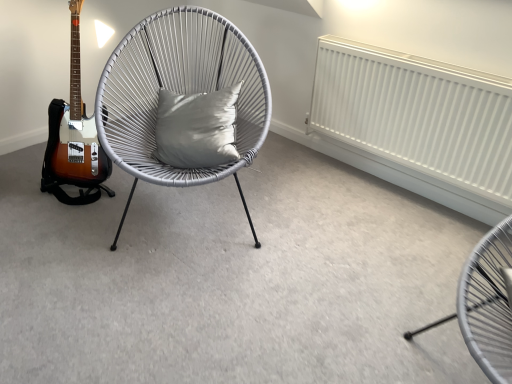
Question: From a real-world perspective, is satin gray cushion at center located beneath white matte radiator at upper right?

Choices:
 (A) no
 (B) yes

Answer: (A)

Question: Considering the relative positions of satin gray cushion at center and white matte radiator at upper right in the image provided, is satin gray cushion at center to the right of white matte radiator at upper right from the viewer's perspective?

Choices:
 (A) yes
 (B) no

Answer: (B)

Question: Considering the relative sizes of satin gray cushion at center and white matte radiator at upper right in the image provided, is satin gray cushion at center bigger than white matte radiator at upper right?

Choices:
 (A) yes
 (B) no

Answer: (B)

Question: From a real-world perspective, is satin gray cushion at center over white matte radiator at upper right?

Choices:
 (A) no
 (B) yes

Answer: (B)

Question: Does satin gray cushion at center come in front of white matte radiator at upper right?

Choices:
 (A) no
 (B) yes

Answer: (A)

Question: Does satin gray cushion at center have a lesser width compared to white matte radiator at upper right?

Choices:
 (A) yes
 (B) no

Answer: (B)

Question: From a real-world perspective, does matte grey chair at lower right, placed as the second chair when sorted from back to front, sit lower than satin gray cushion at center?

Choices:
 (A) no
 (B) yes

Answer: (B)

Question: Is satin gray cushion at center inside matte grey chair at lower right, placed as the second chair when sorted from back to front?

Choices:
 (A) yes
 (B) no

Answer: (B)

Question: Is the position of matte grey chair at lower right, the 1th chair positioned from the right, more distant than that of satin gray cushion at center?

Choices:
 (A) no
 (B) yes

Answer: (A)

Question: From a real-world perspective, is matte grey chair at lower right, the 1th chair positioned from the right, on top of satin gray cushion at center?

Choices:
 (A) yes
 (B) no

Answer: (B)

Question: Is matte grey chair at lower right, which is the first chair from front to back, bigger than satin gray cushion at center?

Choices:
 (A) yes
 (B) no

Answer: (A)

Question: Does matte grey chair at lower right, the 1th chair positioned from the right, have a greater width compared to satin gray cushion at center?

Choices:
 (A) no
 (B) yes

Answer: (B)

Question: Can you confirm if white woven chair at center, which is the first chair in back-to-front order, is taller than white matte radiator at upper right?

Choices:
 (A) no
 (B) yes

Answer: (B)